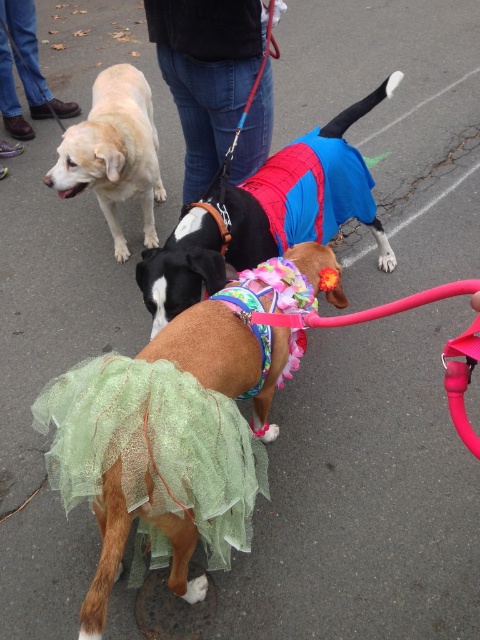
You are a photographer trying to capture a photo of the shiny blue coat at center and the matte yellow dog at left. Based on their positions, which one is closer to the camera?

The shiny blue coat at center is positioned under the matte yellow dog at left, meaning the matte yellow dog at left is closer to the camera.

You are a photographer trying to capture a clear shot of the green tulle ballet skirt at center and the brushed leather shoes at lower left. Since you want both subjects in focus, which one should you focus on first to ensure the other is also in the frame?

The green tulle ballet skirt at center is in front of the brushed leather shoes at lower left. Therefore, focusing on the green tulle ballet skirt at center first will ensure the brushed leather shoes at lower left are also in focus since it is behind it.

You are a photographer trying to capture the dogs in the scene. You notice a shiny blue coat at center located at point (266, 216). Can you determine which dog is wearing the shiny blue coat at center?

The shiny blue coat at center is worn by the dog dressed in a Spider Man costume.